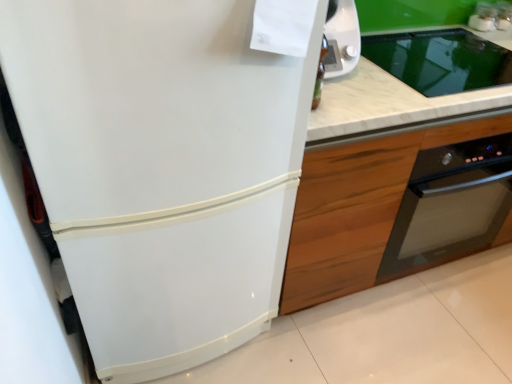
Question: Is white glossy refrigerator at left wider or thinner than wooden cabinet at right?

Choices:
 (A) thin
 (B) wide

Answer: (B)

Question: Is white glossy refrigerator at left inside the boundaries of wooden cabinet at right, or outside?

Choices:
 (A) inside
 (B) outside

Answer: (B)

Question: Estimate the real-world distances between objects in this image. Which object is closer to the white glossy refrigerator at left?

Choices:
 (A) wooden cabinet at right
 (B) white marble countertop at center

Answer: (A)

Question: Estimate the real-world distances between objects in this image. Which object is closer to the white marble countertop at center?

Choices:
 (A) white glossy refrigerator at left
 (B) wooden cabinet at right

Answer: (B)